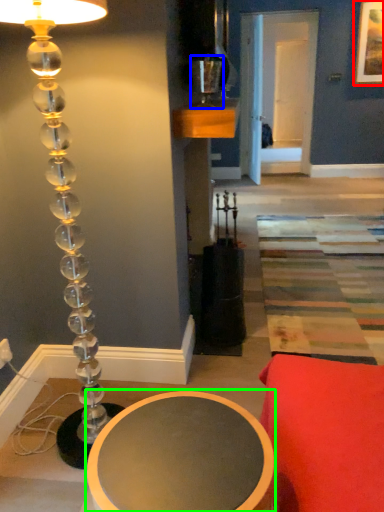
Question: Which object is the farthest from picture frame (highlighted by a red box)? Choose among these: candle holder (highlighted by a blue box) or table (highlighted by a green box).

Choices:
 (A) candle holder
 (B) table

Answer: (B)